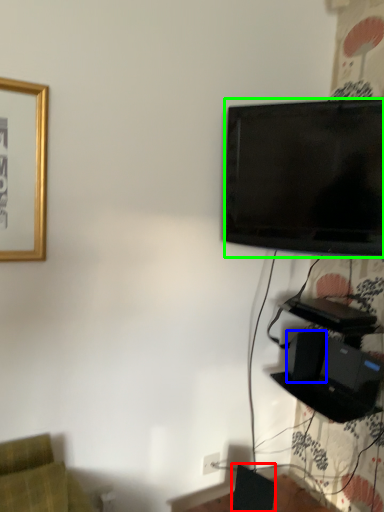
Question: Which is farther away from speaker (highlighted by a red box)? speaker (highlighted by a blue box) or television (highlighted by a green box)?

Choices:
 (A) speaker
 (B) television

Answer: (B)